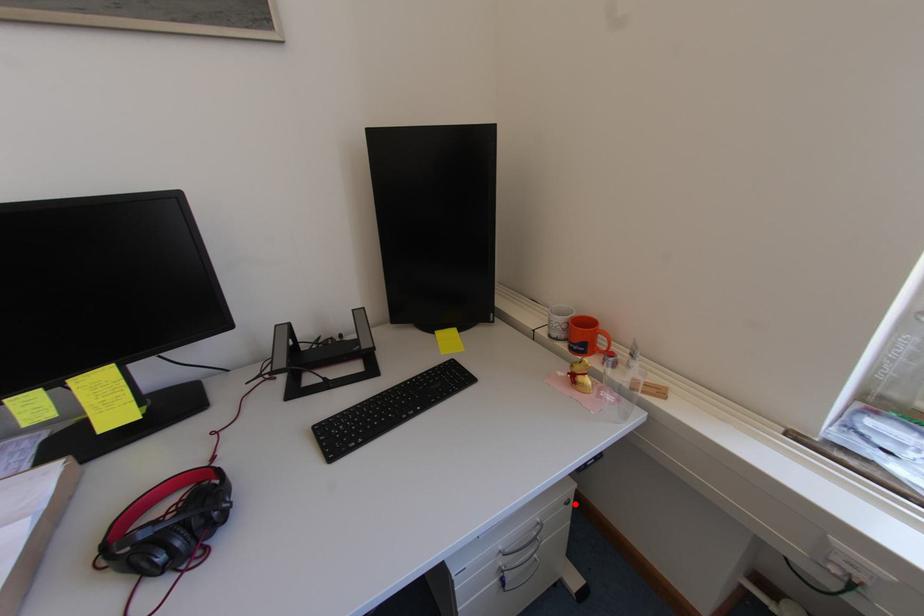
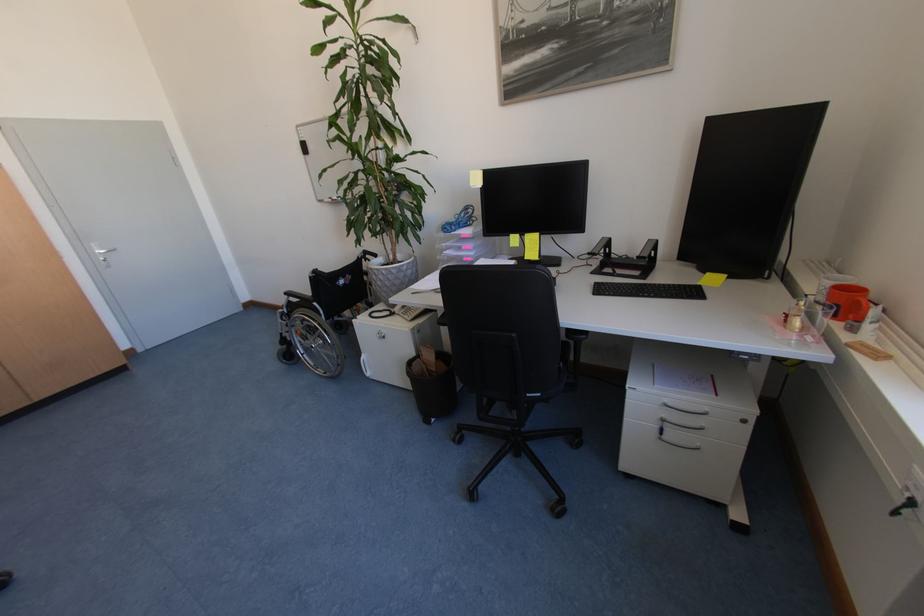
Question: I am providing you with two images of the same scene from different viewpoints. Image1 has a red point marked. In image2, the corresponding 3D location appears at what relative position? Reply with the corresponding letter.

Choices:
 (A) Closer
 (B) Farther

Answer: (A)